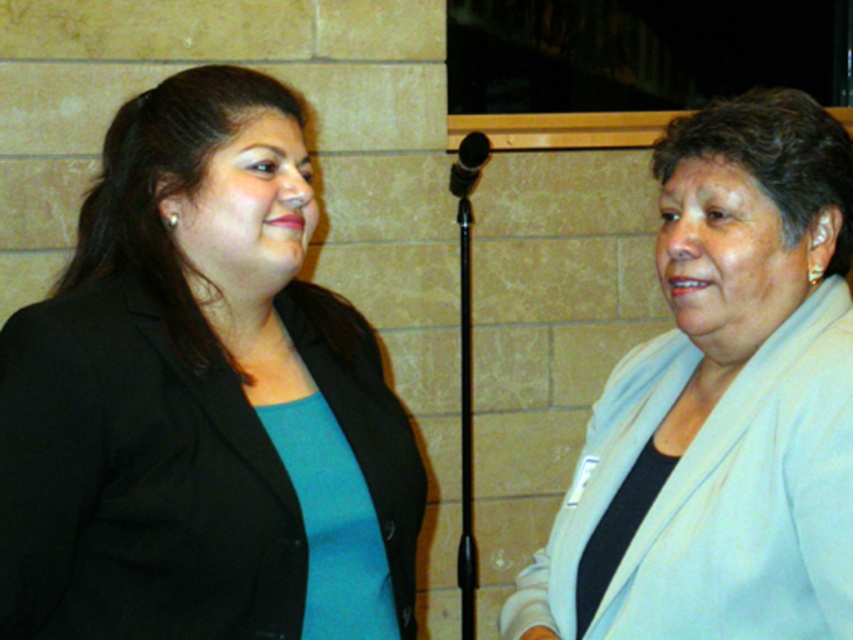
I want to click on matte black blazer at left, so click(202, 401).

Who is higher up, matte black blazer at left or light beige jacket at right?

matte black blazer at left

Where is `matte black blazer at left`? matte black blazer at left is located at coordinates (202, 401).

Locate an element on the screen. This screenshot has width=853, height=640. matte black blazer at left is located at coordinates (202, 401).